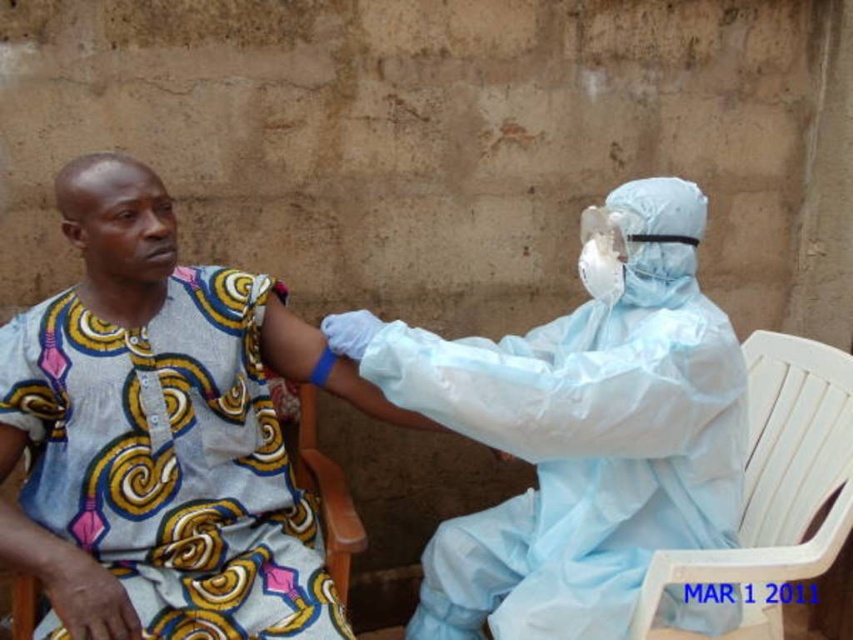
You are a photographer positioned at the front of the scene. You want to take a photo that includes both the light blue protective suit at center and the wooden chair at lower center. Which object should you adjust your focus to first to ensure both are in the frame?

You should focus on the light blue protective suit at center first since it is closer to the viewer than the wooden chair at lower center, allowing you to adjust the framing to include both.

You are a delivery person who needs to place a package between the light blue protective suit at center and the wooden chair at lower center. The package is 20 inches long. Can you fit it between them without moving either object?

The distance between the light blue protective suit at center and the wooden chair at lower center is 18.92 inches, which is shorter than the package length of 20 inches. Therefore, the package cannot be placed between them without moving either object.

You are a delivery robot with a package that needs to be placed between the light blue protective suit at center and the white plastic chair at right. The package is 13 inches long. Can you fit it between them?

The distance between the light blue protective suit at center and the white plastic chair at right is 12.58 inches. Since the package is 13 inches long, it cannot fit between them as the space is slightly smaller than the package.